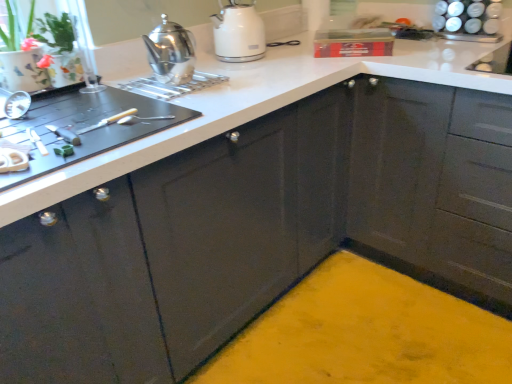
Where is `vacant region above black rubber cutting board at left (from a real-world perspective)`? The width and height of the screenshot is (512, 384). vacant region above black rubber cutting board at left (from a real-world perspective) is located at coordinates (74, 124).